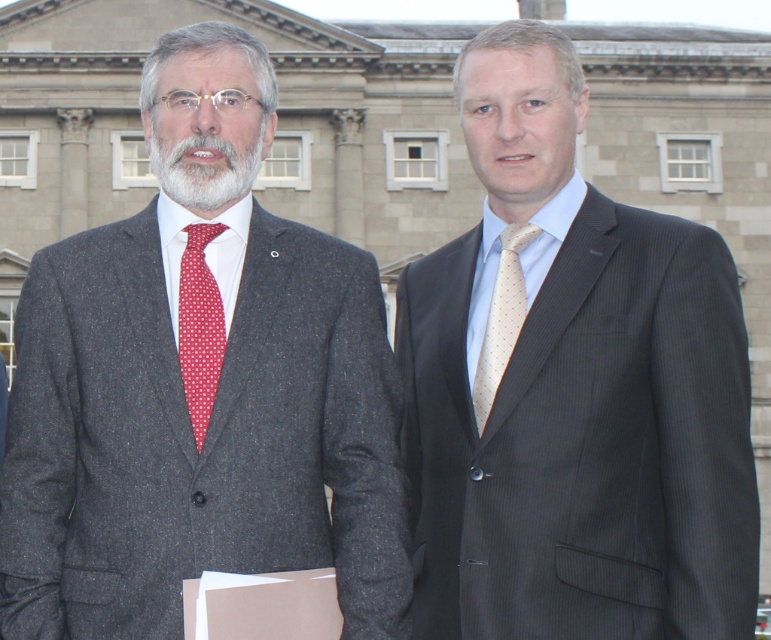
Question: Is matte gray suit at left positioned behind pale yellow dotted tie at center?

Choices:
 (A) no
 (B) yes

Answer: (A)

Question: Which object is closer to the camera taking this photo?

Choices:
 (A) pale yellow dotted tie at center
 (B) gray/woolly beard at center
 (C) matte gray suit at left
 (D) matte black suit at right

Answer: (D)

Question: Among these objects, which one is farthest from the camera?

Choices:
 (A) matte gray suit at left
 (B) matte black suit at right
 (C) red dotted fabric tie at left

Answer: (C)

Question: Does matte black suit at right have a greater width compared to gray/woolly beard at center?

Choices:
 (A) yes
 (B) no

Answer: (A)

Question: Can you confirm if matte gray suit at left is thinner than pale yellow dotted tie at center?

Choices:
 (A) no
 (B) yes

Answer: (A)

Question: Among these objects, which one is farthest from the camera?

Choices:
 (A) matte black suit at right
 (B) matte gray suit at left
 (C) gray/woolly beard at center

Answer: (C)